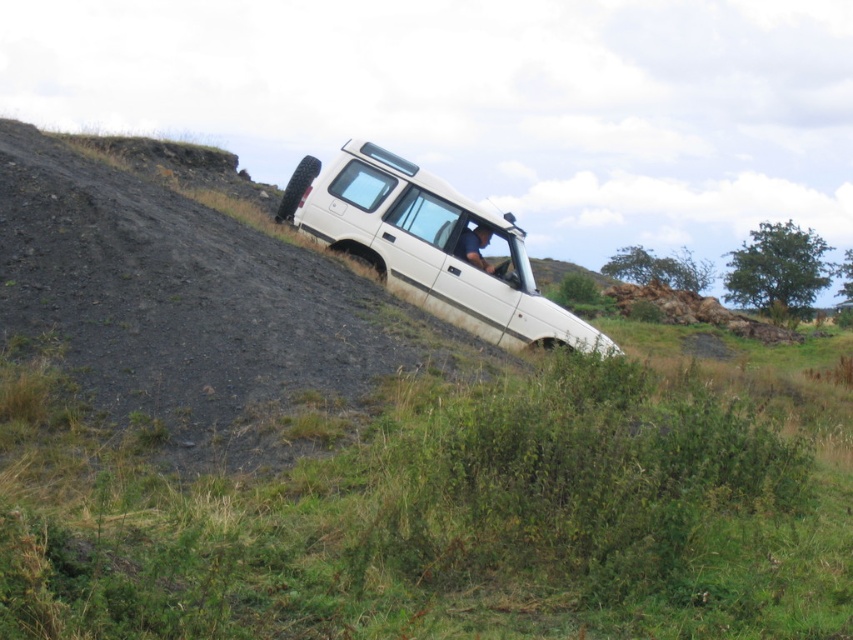
Between white matte suv at center and dark blue fabric at center, which one appears on the left side from the viewer's perspective?

From the viewer's perspective, white matte suv at center appears more on the left side.

Who is shorter, white matte suv at center or dark blue fabric at center?

dark blue fabric at center

Identify the location of white matte suv at center. (431, 248).